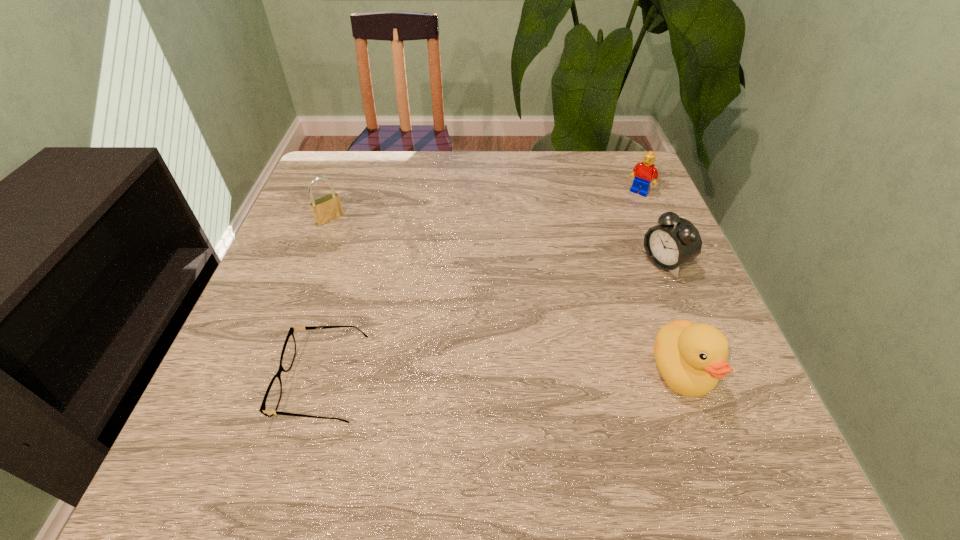
I want to click on padlock that is positioned at the left edge, so click(325, 209).

In order to click on duck present at the right edge in this screenshot , I will do `click(691, 358)`.

This screenshot has height=540, width=960. I want to click on alarm clock at the right edge, so click(x=675, y=241).

At what (x,y) coordinates should I click in order to perform the action: click on Lego that is at the right edge. Please return your answer as a coordinate pair (x, y). Looking at the image, I should click on 644,172.

The width and height of the screenshot is (960, 540). In order to click on object positioned at the near left corner in this screenshot , I will do `click(271, 400)`.

Locate an element on the screen. The image size is (960, 540). object that is at the far right corner is located at coordinates (644, 172).

Identify the location of object situated at the near right corner. Image resolution: width=960 pixels, height=540 pixels. (691, 358).

Locate an element on the screen. vacant space at the far edge of the desktop is located at coordinates (578, 191).

At what (x,y) coordinates should I click in order to perform the action: click on vacant point at the left edge. Please return your answer as a coordinate pair (x, y). Looking at the image, I should click on (259, 362).

In the image, there is a desktop. At what (x,y) coordinates should I click in order to perform the action: click on vacant region at the right edge. Please return your answer as a coordinate pair (x, y). This screenshot has height=540, width=960. Looking at the image, I should click on (638, 275).